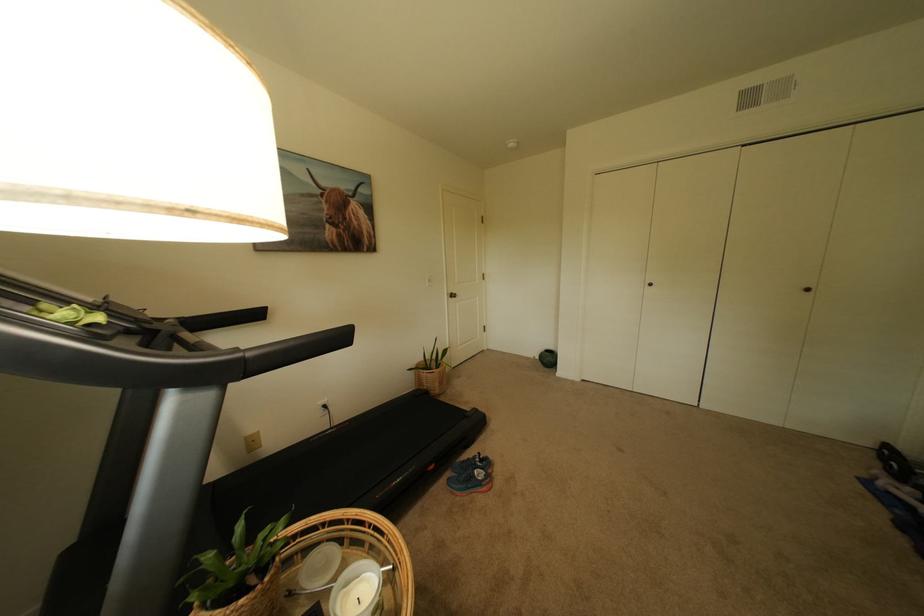
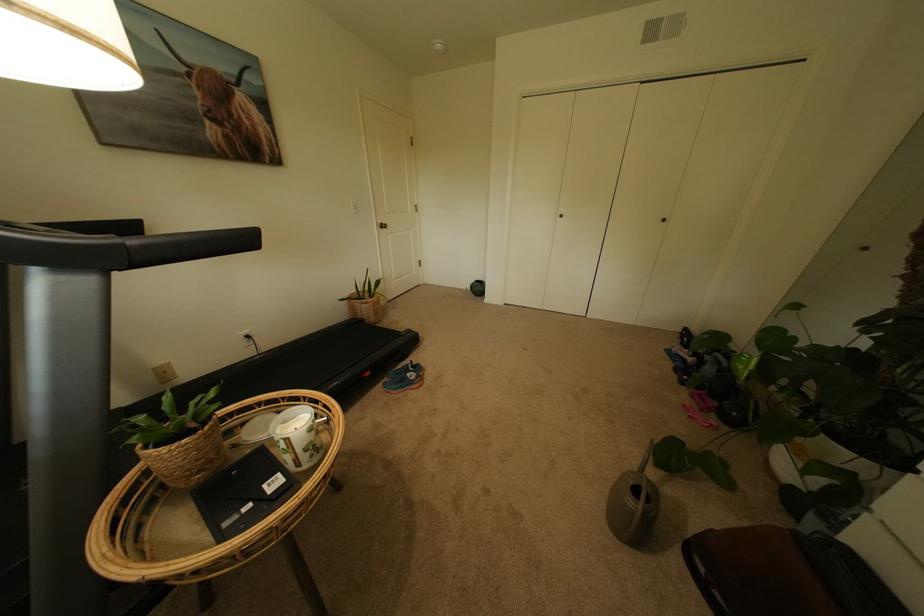
The point at (309, 556) is marked in the first image. Where is the corresponding point in the second image?

(248, 429)